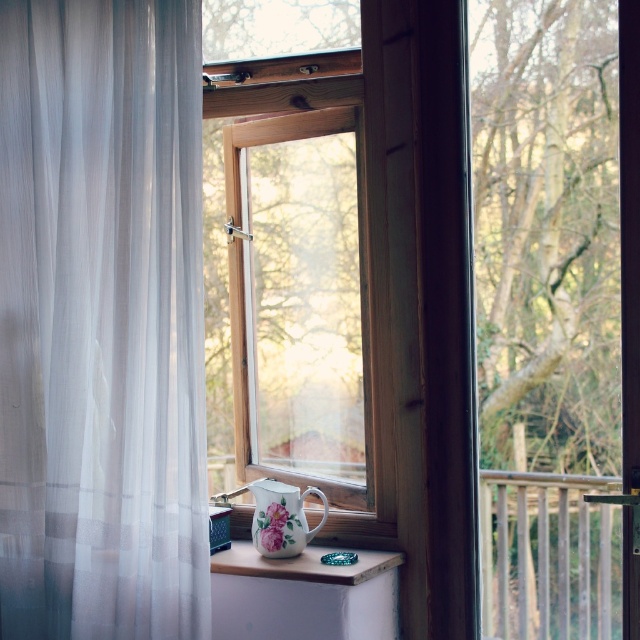
How distant is white wood at center from porcelain floral pitcher at center?

white wood at center is 2.47 centimeters from porcelain floral pitcher at center.

Is white wood at center to the right of porcelain floral pitcher at center from the viewer's perspective?

No, white wood at center is not to the right of porcelain floral pitcher at center.

Describe the element at coordinates (301, 595) in the screenshot. I see `white wood at center` at that location.

Identify the location of white wood at center. (301, 595).

Is white wood at center closer to the viewer compared to porcelain floral mug at lower center?

Yes, white wood at center is in front of porcelain floral mug at lower center.

Does white wood at center lie behind porcelain floral mug at lower center?

No, it is not.

Who is more distant from viewer, (310, 608) or (301, 509)?

The point (301, 509) is behind.

Identify the location of white wood at center. This screenshot has width=640, height=640. (301, 595).

Is point (80, 525) less distant than point (602, 540)?

No.

Who is positioned more to the left, white sheer curtain at left or wooden railing at right?

Positioned to the left is white sheer curtain at left.

What do you see at coordinates (100, 321) in the screenshot? Image resolution: width=640 pixels, height=640 pixels. I see `white sheer curtain at left` at bounding box center [100, 321].

The height and width of the screenshot is (640, 640). Find the location of `white sheer curtain at left`. white sheer curtain at left is located at coordinates (100, 321).